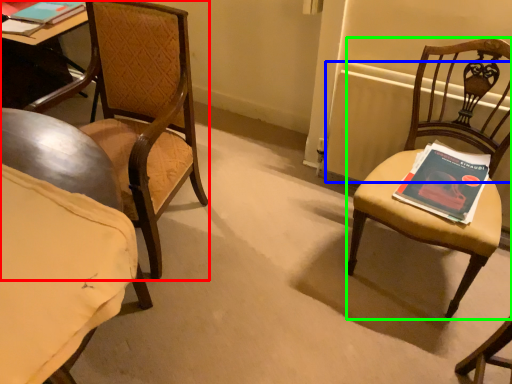
Question: Based on their relative distances, which object is nearer to chair (highlighted by a red box)? Choose from radiator (highlighted by a blue box) and chair (highlighted by a green box).

Choices:
 (A) radiator
 (B) chair

Answer: (A)